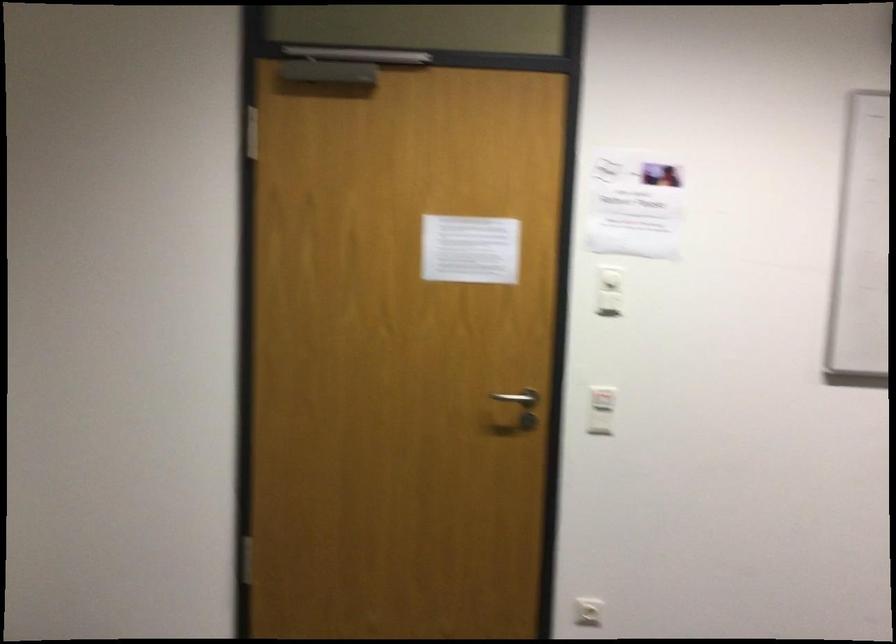
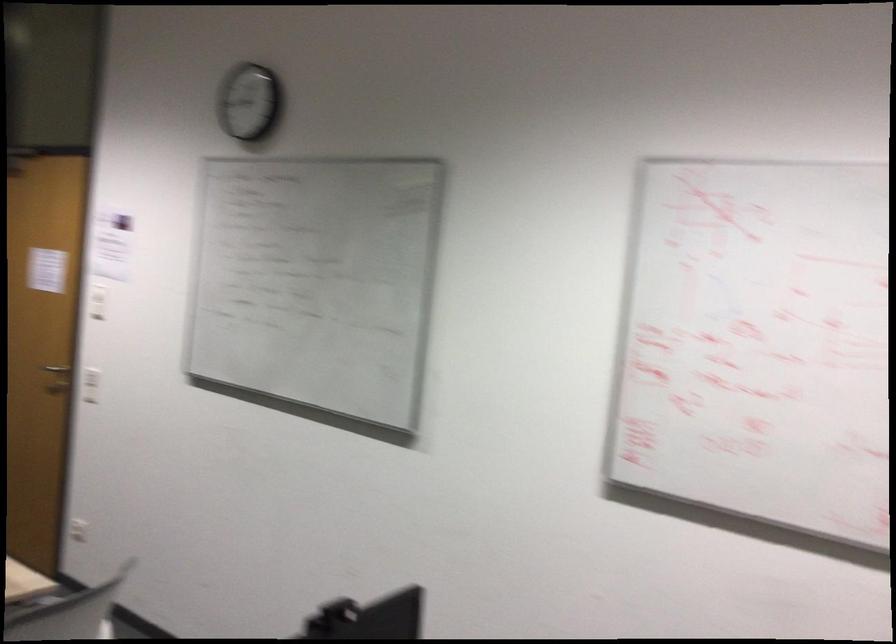
In the second image, find the point that corresponds to (x=504, y=420) in the first image.

(90, 384)